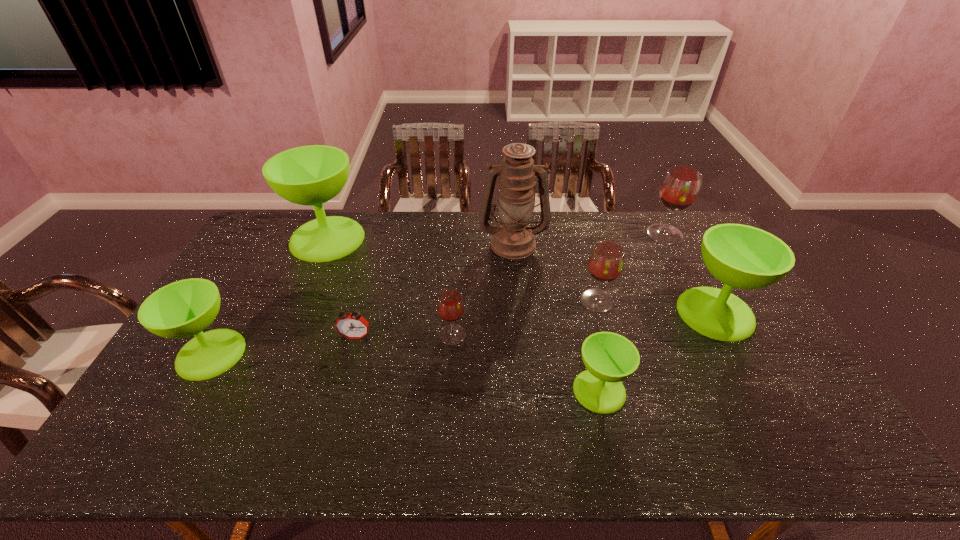
Where is `wineglass that is the closest to the second red wineglass from left to right`? The height and width of the screenshot is (540, 960). wineglass that is the closest to the second red wineglass from left to right is located at coordinates (741, 256).

At what (x,y) coordinates should I click in order to perform the action: click on green wineglass that is the second closest to the second farthest red wineglass. Please return your answer as a coordinate pair (x, y). The width and height of the screenshot is (960, 540). Looking at the image, I should click on (609, 358).

The width and height of the screenshot is (960, 540). I want to click on green wineglass that is the third closest one to the third green wineglass from left to right, so click(x=181, y=309).

Point out which red wineglass is positioned as the third nearest to the third biggest green wineglass. Please provide its 2D coordinates. Your answer should be formatted as a tuple, i.e. [(x, y)], where the tuple contains the x and y coordinates of a point satisfying the conditions above.

[(680, 187)]

Choose which red wineglass is the third nearest neighbor to the third green wineglass from left to right. Please provide its 2D coordinates. Your answer should be formatted as a tuple, i.e. [(x, y)], where the tuple contains the x and y coordinates of a point satisfying the conditions above.

[(680, 187)]

I want to click on vacant space that satisfies the following two spatial constraints: 1. on the front side of the second biggest green wineglass; 2. on the left side of the tallest object, so click(519, 313).